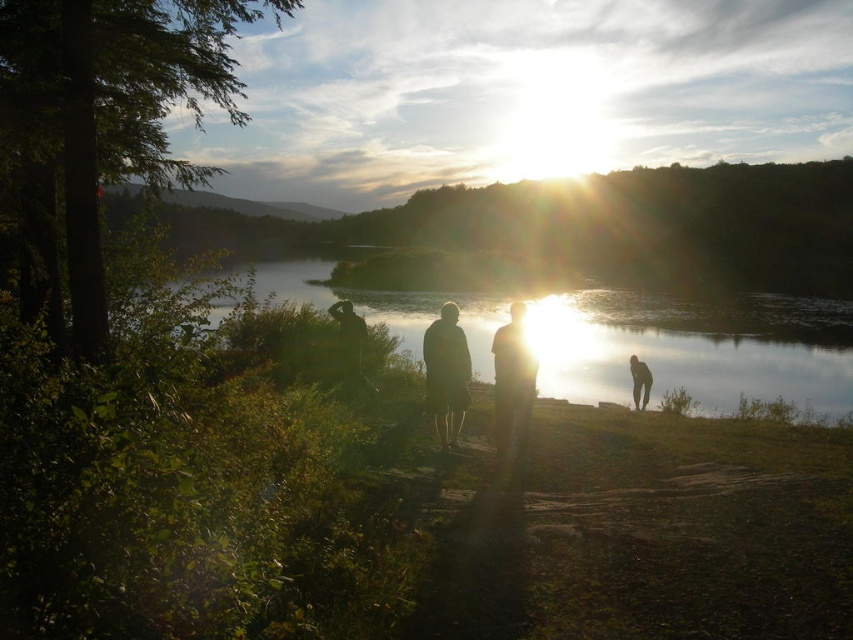
Question: Which of these objects is positioned closest to the glistening reflective water at center?

Choices:
 (A) smooth skin person at lower right
 (B) dark gray fabric jacket at center
 (C) silhouette figure at center

Answer: (B)

Question: Does glistening reflective water at center come behind smooth skin person at lower right?

Choices:
 (A) yes
 (B) no

Answer: (B)

Question: Which point is closer to the camera taking this photo?

Choices:
 (A) (521, 417)
 (B) (444, 344)
 (C) (635, 371)
 (D) (459, 298)

Answer: (A)

Question: Which point is closer to the camera taking this photo?

Choices:
 (A) tap(422, 339)
 (B) tap(582, 298)
 (C) tap(514, 371)

Answer: (C)

Question: Is glistening reflective water at center positioned behind silhouette figure at center?

Choices:
 (A) no
 (B) yes

Answer: (A)

Question: Is dark gray fabric jacket at center positioned in front of smooth skin person at lower right?

Choices:
 (A) no
 (B) yes

Answer: (B)